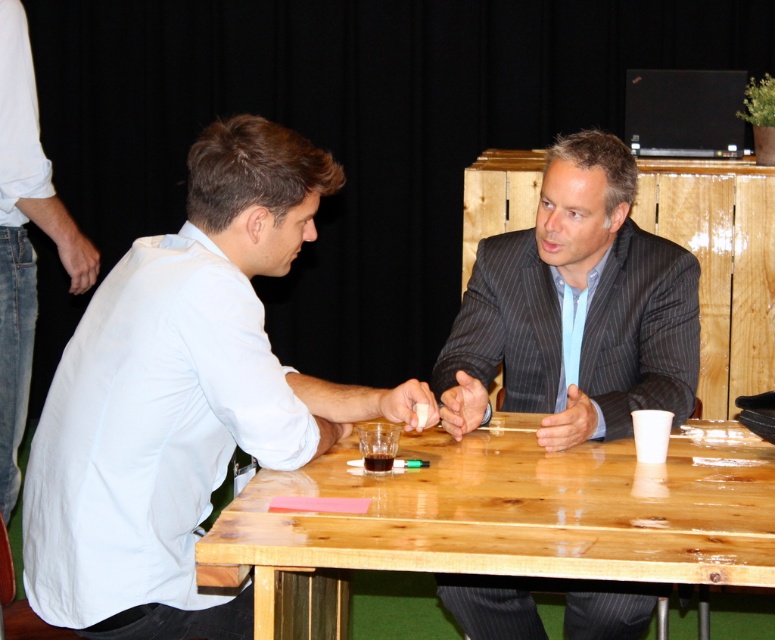
You are a photographer setting up for a photo shoot. The wooden table at center is in the middle of the room, and the white cotton shirt at left is on the left side. You need to place a large camera on the table without blocking the shirt. Can the camera fit on the table?

The wooden table at center has a larger width than the white cotton shirt at left, so the camera can fit on the table without blocking the shirt.

You are a tailor measuring clothing for the person in the white matte shirt at left and the wooden table at center. Which item requires a wider measurement for its width?

The wooden table at center requires a wider measurement for its width because the white matte shirt at left is narrower than the wooden table at center.